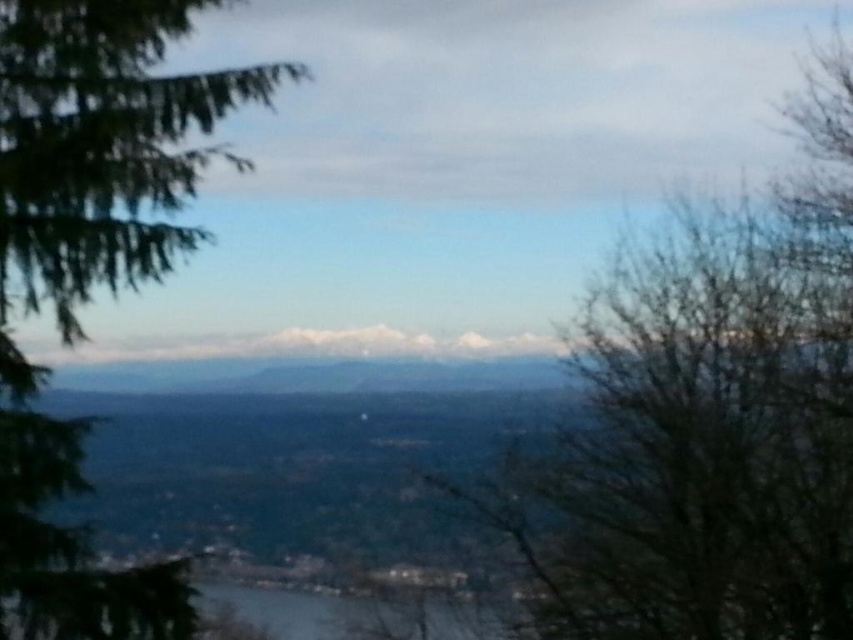
You are an environmental scientist analyzing the landscape. You need to determine which area has more vegetation density based on the visible trees. Which side of the image has a denser vegetation area between the bare branches at right and the green textured pine tree at left?

The green textured pine tree at left has a denser vegetation area since it has a greater width compared to the bare branches at right, indicating more foliage and thus higher density.

You are an environmental scientist analyzing this landscape. You need to determine the relative elevation of the bare branches at right and the green textured pine tree at left. Based on the scene, which one is located at a higher elevation?

The green textured pine tree at left is located at a higher elevation because the bare branches at right is below it.

You are standing in the middle of the valley and see the point marked as point (709, 419). What is the nearest object to you in the scene?

The nearest object to you is the bare branches at right, which is represented by point (709, 419).